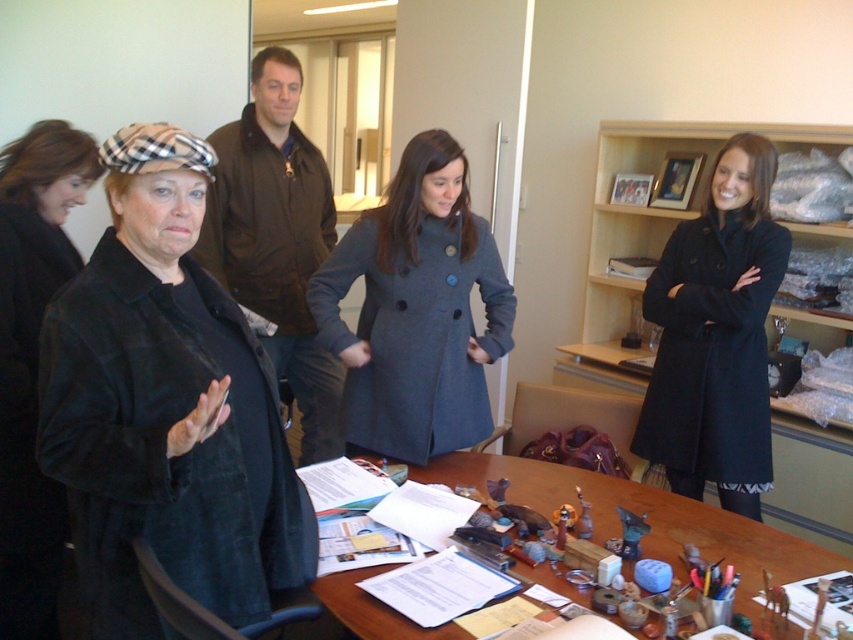
You are standing in the office scene described. There is a black wool coat at right located at point (717, 336). If you want to place a coffee mug on the table without moving any existing items, where should you put it?

The black wool coat at right is located at point (717, 336). Since the table is cluttered with items like papers, documents, and office supplies, you should place the coffee mug in an empty space on the table that doesn

You are organizing a coat rack in the office and need to hang the black wool coat at right and the black velvet coat at center. Since the rack has limited space, can you determine which coat should be placed higher to avoid overlapping?

The black wool coat at right should be placed higher on the coat rack because it is located above the black velvet coat at center in the image, suggesting it requires a higher position to maintain the same spatial arrangement.